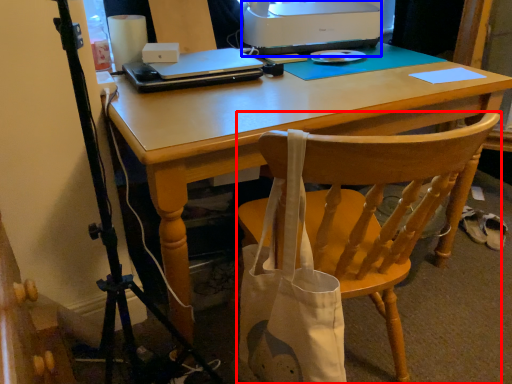
Question: Which of the following is the farthest to the observer, chair (highlighted by a red box) or printer (highlighted by a blue box)?

Choices:
 (A) chair
 (B) printer

Answer: (B)